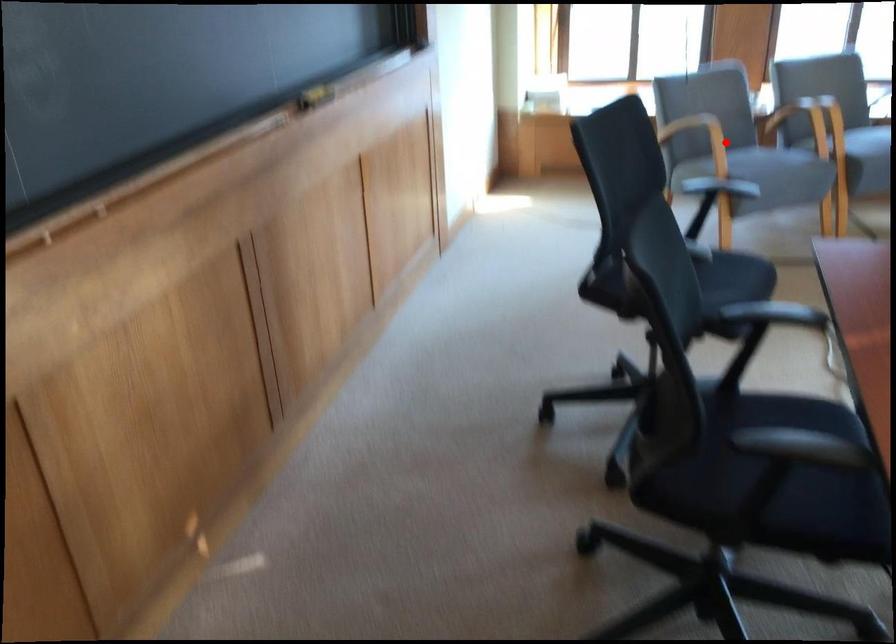
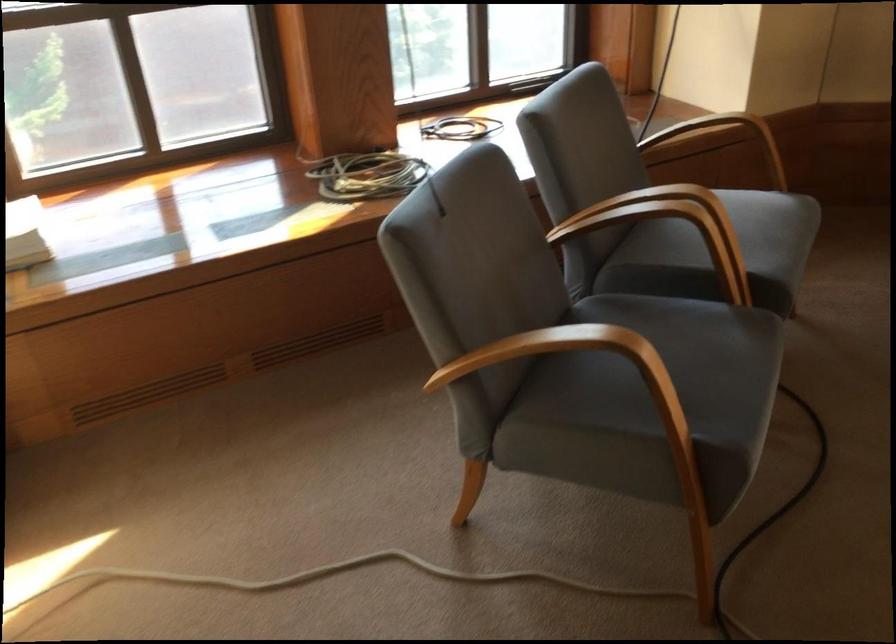
Question: A red point is marked in image1. In image2, is the corresponding 3D point closer to the camera or farther? Reply with the corresponding letter.

Choices:
 (A) The corresponding 3D point is closer.
 (B) The corresponding 3D point is farther.

Answer: (A)